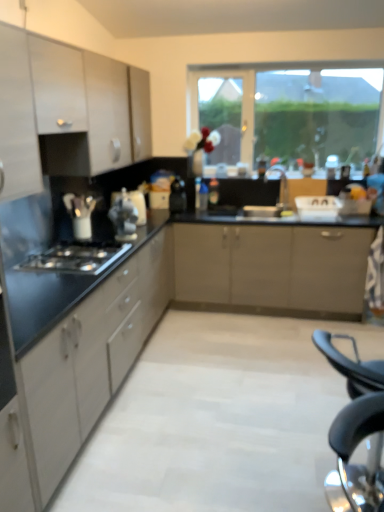
In order to click on vacant area that is in front of matte silver faucet at center in this screenshot , I will do `click(271, 215)`.